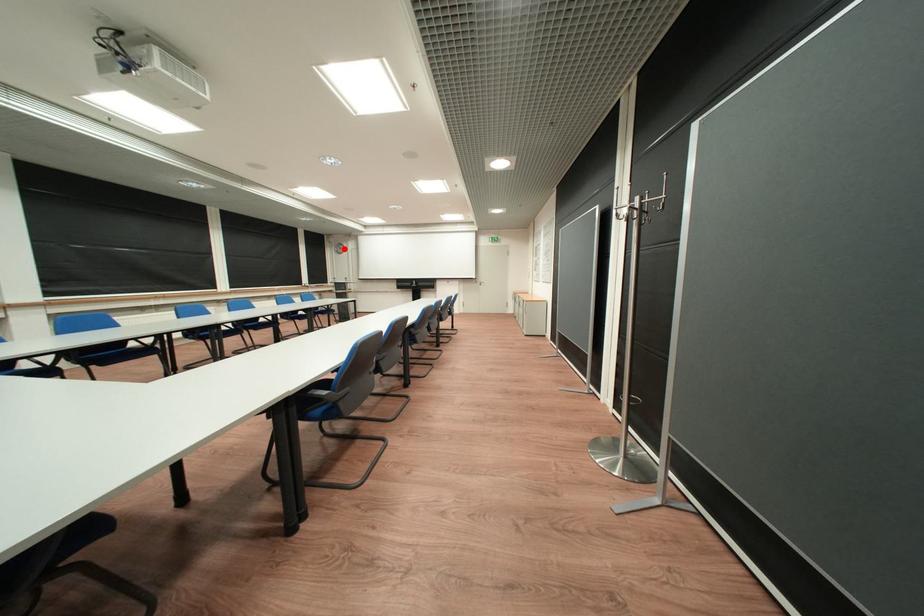
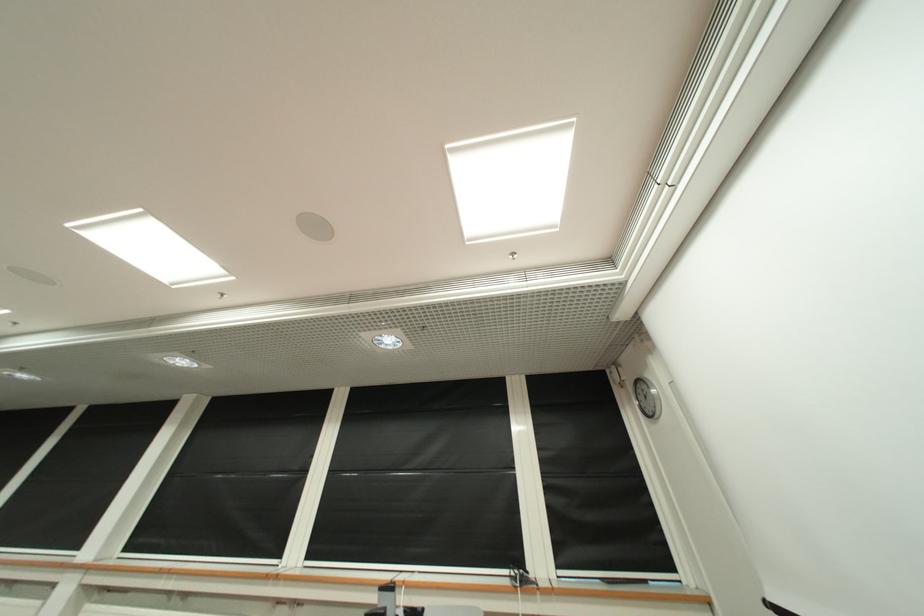
Find the pixel in the second image that matches the highlighted location in the first image.

(642, 402)